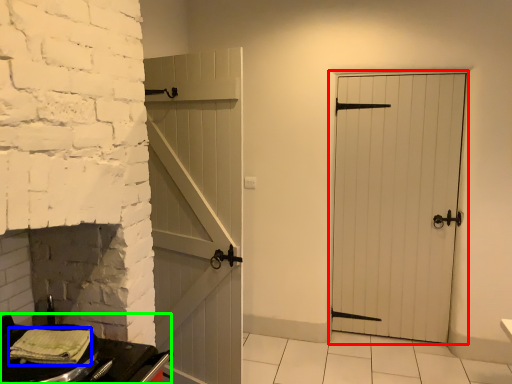
Question: Which object is positioned farthest from door (highlighted by a red box)? Select from material (highlighted by a blue box) and table (highlighted by a green box).

Choices:
 (A) material
 (B) table

Answer: (A)